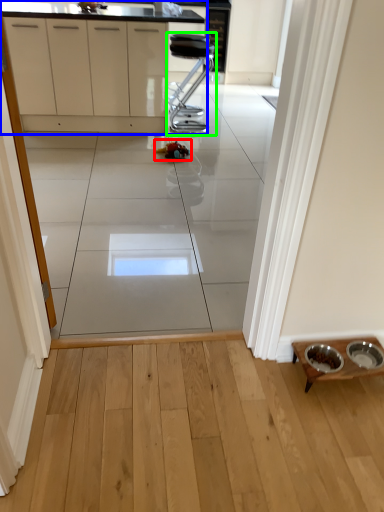
Question: Which object is positioned closest to toy (highlighted by a red box)? Select from cabinetry (highlighted by a blue box) and furniture (highlighted by a green box).

Choices:
 (A) cabinetry
 (B) furniture

Answer: (B)